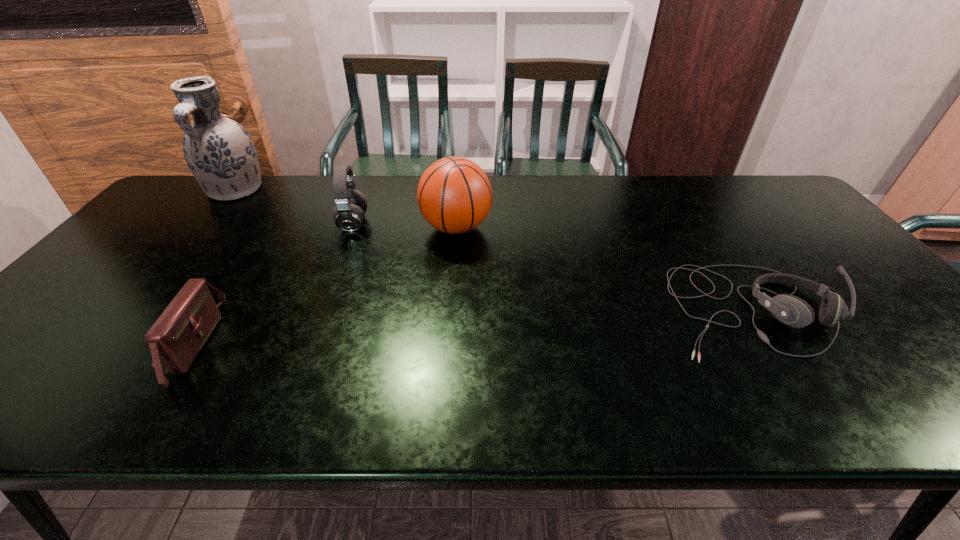
The image size is (960, 540). What are the coordinates of `unoccupied position between the nearer headset and the vase` in the screenshot? It's located at (492, 250).

Image resolution: width=960 pixels, height=540 pixels. Identify the location of empty space that is in between the second shortest object and the second object from right to left. 324,286.

The height and width of the screenshot is (540, 960). Identify the location of vacant space in between the fourth object from right to left and the third tallest object. (272, 284).

Select which object is the fourth closest to the fourth object from left to right. Please provide its 2D coordinates. Your answer should be formatted as a tuple, i.e. [(x, y)], where the tuple contains the x and y coordinates of a point satisfying the conditions above.

[(219, 152)]

Point out which object is positioned as the fourth nearest to the left headset. Please provide its 2D coordinates. Your answer should be formatted as a tuple, i.e. [(x, y)], where the tuple contains the x and y coordinates of a point satisfying the conditions above.

[(791, 310)]

Locate an element on the screen. blank space that satisfies the following two spatial constraints: 1. with the handle on the side of the leftmost object; 2. on the right side of the second object from right to left is located at coordinates (204, 227).